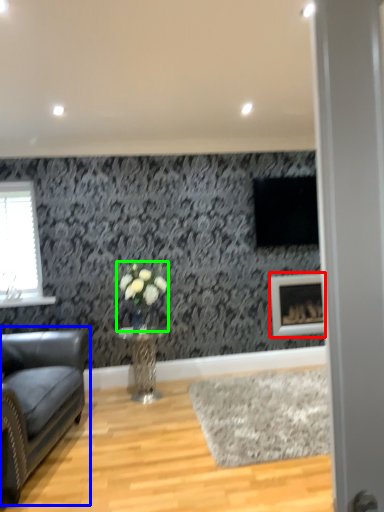
Question: Based on their relative distances, which object is farther from picture frame (highlighted by a red box)? Choose from studio couch (highlighted by a blue box) and floral arrangement (highlighted by a green box).

Choices:
 (A) studio couch
 (B) floral arrangement

Answer: (A)